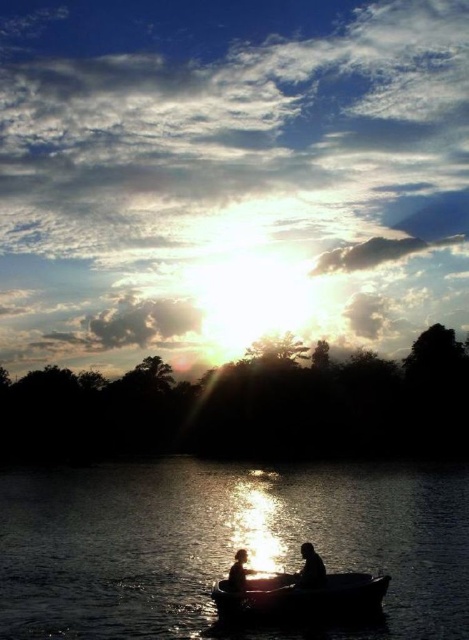
Question: Is silvery reflective water at center positioned before silhouette human at lower center?

Choices:
 (A) no
 (B) yes

Answer: (B)

Question: Does silvery reflective water at center come in front of silhouette human at center?

Choices:
 (A) no
 (B) yes

Answer: (B)

Question: Does silvery reflective water at center have a lesser width compared to silvery metallic boat at center?

Choices:
 (A) no
 (B) yes

Answer: (A)

Question: Which point is farther from the camera taking this photo?

Choices:
 (A) (243, 605)
 (B) (309, 577)
 (C) (431, 502)
 (D) (234, 564)

Answer: (C)

Question: Which point appears farthest from the camera in this image?

Choices:
 (A) (257, 602)
 (B) (235, 536)
 (C) (233, 584)
 (D) (324, 570)

Answer: (B)

Question: Which of the following is the closest to the observer?

Choices:
 (A) click(x=289, y=602)
 (B) click(x=212, y=506)

Answer: (A)